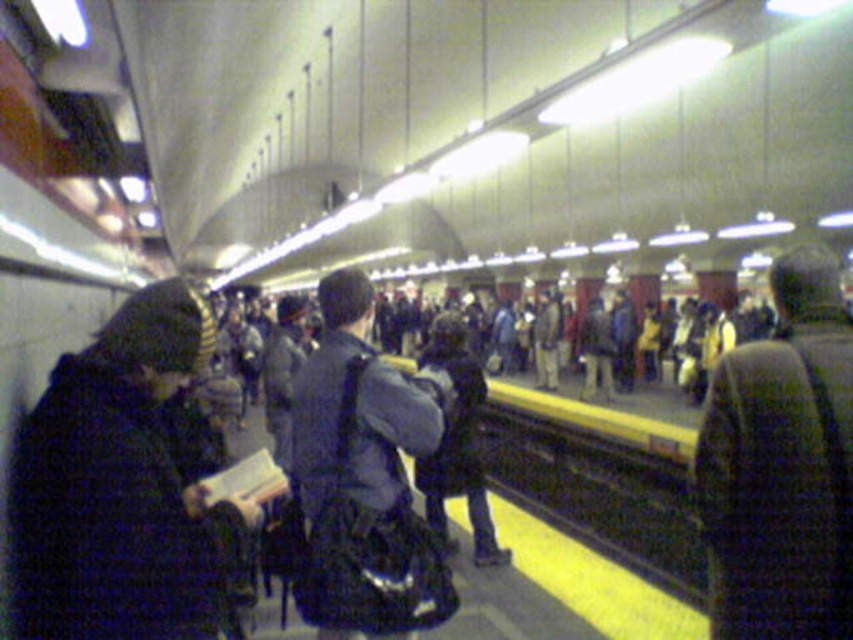
You are a photographer trying to capture a candid shot of the black fuzzy coat at left and the knitted wool hat at upper right. Since you want to include both subjects in the frame, which one should you focus on first to ensure both are in focus?

The black fuzzy coat at left is positioned over the knitted wool hat at upper right, so focusing on the black fuzzy coat at left first will ensure both are in focus as the hat is behind it.

You are a photographer standing on the subway platform. You want to capture a photo of the knitted wool hat at upper right and the dark blue jacket at center. Which object appears taller in the photo?

The knitted wool hat at upper right appears taller than the dark blue jacket at center in the photo.

You are a photographer trying to capture a candid shot of the dark blue jacket at center without including the knitted wool hat at upper right in the frame. Based on their positions, is this possible?

The knitted wool hat at upper right is positioned on the right side of dark blue jacket at center. Since the hat is to the right of the jacket, you can frame the shot to exclude the hat by focusing solely on the left side of the jacket.